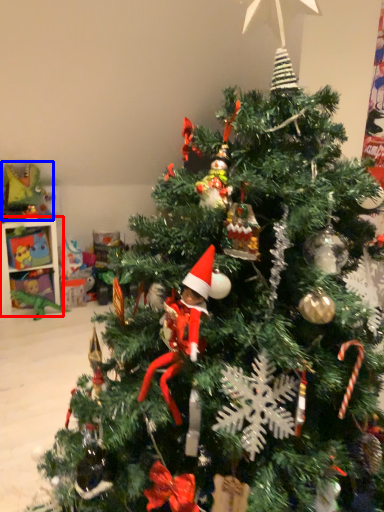
Question: Which of the following is the closest to the observer, shelf (highlighted by a red box) or toy (highlighted by a blue box)?

Choices:
 (A) shelf
 (B) toy

Answer: (B)